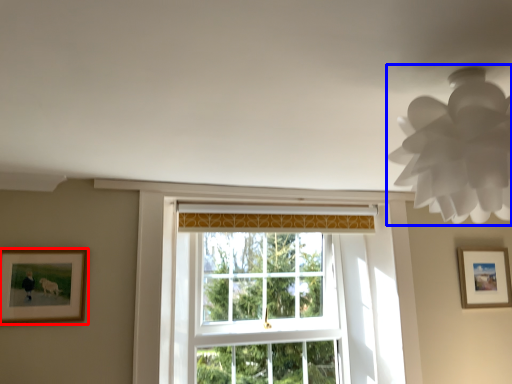
Question: Which point is further to the camera, picture frame (highlighted by a red box) or lamp (highlighted by a blue box)?

Choices:
 (A) picture frame
 (B) lamp

Answer: (A)